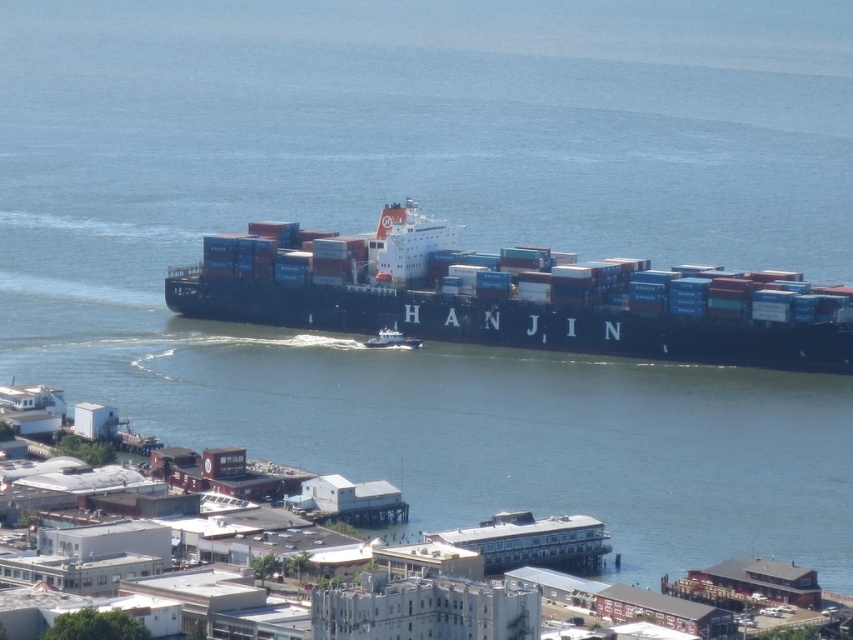
Does blue matte container ship at center have a lesser width compared to white glossy boat at center?

No, blue matte container ship at center is not thinner than white glossy boat at center.

Does blue matte container ship at center have a greater width compared to white glossy boat at center?

Yes, blue matte container ship at center is wider than white glossy boat at center.

Describe the element at coordinates (511, 296) in the screenshot. This screenshot has width=853, height=640. I see `blue matte container ship at center` at that location.

I want to click on blue matte container ship at center, so click(511, 296).